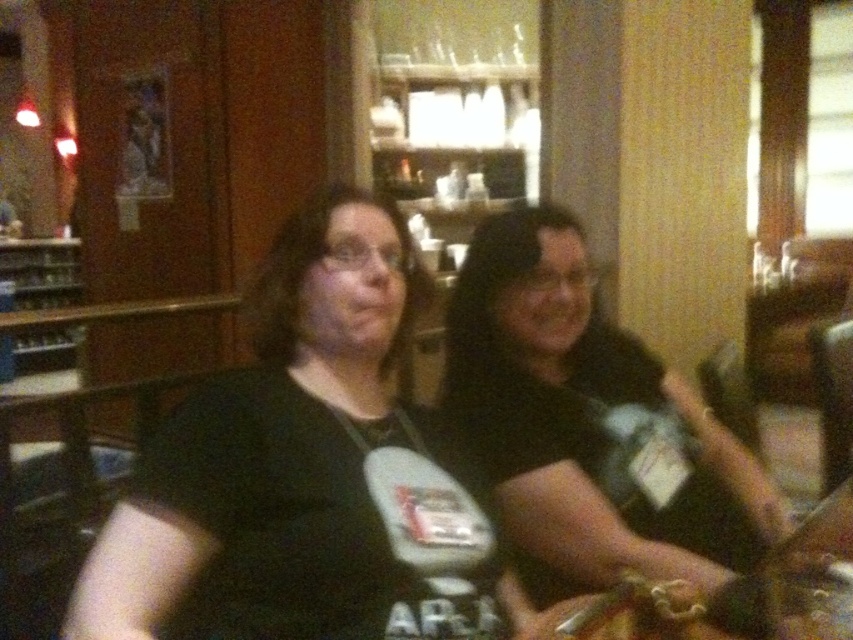
Question: Is black matte shirt at center bigger than clear plastic bottle at center?

Choices:
 (A) yes
 (B) no

Answer: (A)

Question: Which object appears farthest from the camera in this image?

Choices:
 (A) clear plastic bottle at center
 (B) black matte shirt at center

Answer: (A)

Question: Is black matte shirt at center above clear plastic bottle at center?

Choices:
 (A) no
 (B) yes

Answer: (B)

Question: Is black matte shirt at center further to camera compared to clear plastic bottle at center?

Choices:
 (A) yes
 (B) no

Answer: (B)

Question: Which point is farther to the camera?

Choices:
 (A) (231, 476)
 (B) (663, 432)
 (C) (524, 576)

Answer: (B)

Question: Which object is closer to the camera taking this photo?

Choices:
 (A) clear plastic bottle at center
 (B) black matte t-shirt at center
 (C) black matte shirt at center

Answer: (B)